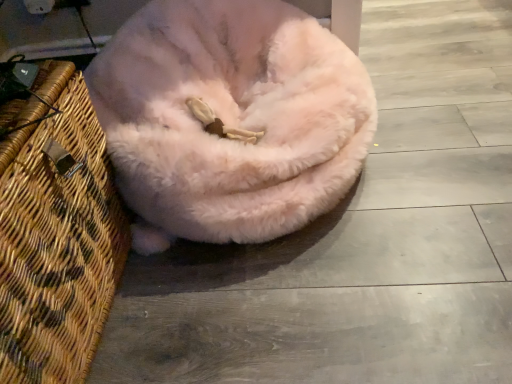
Question: Is woven wood basket at left touching pink fluffy dog bed at center?

Choices:
 (A) yes
 (B) no

Answer: (B)

Question: Considering the relative sizes of woven wood basket at left and pink fluffy dog bed at center in the image provided, is woven wood basket at left bigger than pink fluffy dog bed at center?

Choices:
 (A) yes
 (B) no

Answer: (B)

Question: Considering the relative sizes of woven wood basket at left and pink fluffy dog bed at center in the image provided, is woven wood basket at left thinner than pink fluffy dog bed at center?

Choices:
 (A) no
 (B) yes

Answer: (B)

Question: Can you confirm if woven wood basket at left is positioned to the right of pink fluffy dog bed at center?

Choices:
 (A) no
 (B) yes

Answer: (A)

Question: Is the depth of woven wood basket at left greater than that of pink fluffy dog bed at center?

Choices:
 (A) yes
 (B) no

Answer: (B)

Question: From the image's perspective, does woven wood basket at left appear lower than pink fluffy dog bed at center?

Choices:
 (A) no
 (B) yes

Answer: (B)

Question: Is pink fluffy dog bed at center located outside woven wood basket at left?

Choices:
 (A) no
 (B) yes

Answer: (B)

Question: Is pink fluffy dog bed at center taller than woven wood basket at left?

Choices:
 (A) no
 (B) yes

Answer: (A)

Question: Is pink fluffy dog bed at center further to camera compared to woven wood basket at left?

Choices:
 (A) no
 (B) yes

Answer: (B)

Question: Does pink fluffy dog bed at center lie in front of woven wood basket at left?

Choices:
 (A) no
 (B) yes

Answer: (A)

Question: Is pink fluffy dog bed at center positioned with its back to woven wood basket at left?

Choices:
 (A) yes
 (B) no

Answer: (B)

Question: Is pink fluffy dog bed at center shorter than woven wood basket at left?

Choices:
 (A) no
 (B) yes

Answer: (B)

Question: From a real-world perspective, is pink fluffy dog bed at center above or below woven wood basket at left?

Choices:
 (A) below
 (B) above

Answer: (A)